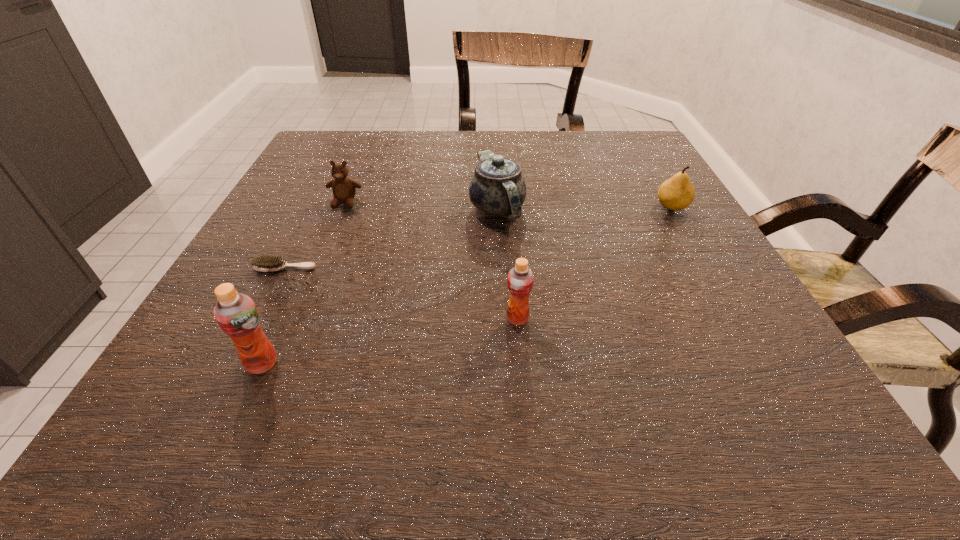
The width and height of the screenshot is (960, 540). Find the location of `free spot between the rightmost object and the chinaware`. free spot between the rightmost object and the chinaware is located at coordinates 585,208.

At what (x,y) coordinates should I click in order to perform the action: click on empty location between the nearest object and the teddy bear. Please return your answer as a coordinate pair (x, y). Looking at the image, I should click on (303, 283).

Image resolution: width=960 pixels, height=540 pixels. Identify the location of empty space between the fourth farthest object and the chinaware. tap(391, 238).

The image size is (960, 540). Identify the location of vacant region between the left orange juice and the third nearest object. (274, 315).

Locate an element on the screen. This screenshot has height=540, width=960. free spot between the scrubbing brush and the teddy bear is located at coordinates pos(315,235).

Where is `the closest object to the pear`? The image size is (960, 540). the closest object to the pear is located at coordinates coord(497,188).

This screenshot has height=540, width=960. In order to click on object that can be found as the closest to the chinaware in this screenshot , I will do `click(520, 280)`.

Where is `blank area in the image that satisfies the following two spatial constraints: 1. on the back side of the rightmost object; 2. on the right side of the taller orange juice`? blank area in the image that satisfies the following two spatial constraints: 1. on the back side of the rightmost object; 2. on the right side of the taller orange juice is located at coordinates (332, 207).

Image resolution: width=960 pixels, height=540 pixels. Find the location of `free region that satisfies the following two spatial constraints: 1. on the front side of the nearer orange juice; 2. on the right side of the shortest object`. free region that satisfies the following two spatial constraints: 1. on the front side of the nearer orange juice; 2. on the right side of the shortest object is located at coordinates (237, 363).

Where is `vacant space that satisfies the following two spatial constraints: 1. at the face of the right orange juice; 2. on the right side of the teddy bear`? Image resolution: width=960 pixels, height=540 pixels. vacant space that satisfies the following two spatial constraints: 1. at the face of the right orange juice; 2. on the right side of the teddy bear is located at coordinates (297, 319).